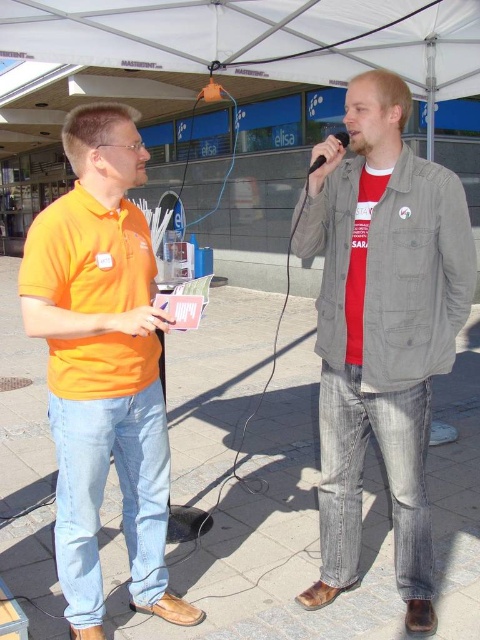
You are a photographer standing in front of the scene. You want to take a photo of the black matte microphone at center without the white fabric canopy at upper center blocking it. Is it possible?

The black matte microphone at center is behind the white fabric canopy at upper center, so it is blocked by the canopy and cannot be seen clearly in the photo without moving the microphone or the canopy.